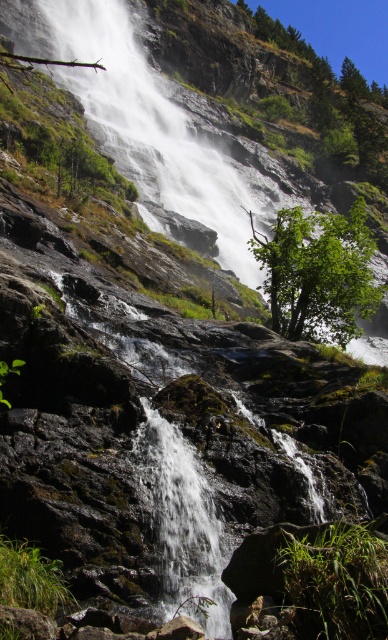
Is the position of green leafy tree at center less distant than that of clear water at center?

No, it is not.

In the scene shown: Who is shorter, green leafy tree at center or clear water at center?

Standing shorter between the two is clear water at center.

Who is more forward, (330, 285) or (154, 429)?

Positioned in front is point (154, 429).

This screenshot has width=388, height=640. Identify the location of green leafy tree at center. (318, 273).

Can you confirm if white smooth waterfall at center is positioned above green leafy tree at center?

Yes, white smooth waterfall at center is above green leafy tree at center.

The image size is (388, 640). Find the location of `white smooth waterfall at center`. white smooth waterfall at center is located at coordinates (152, 129).

Between point (97, 131) and point (282, 209), which one is positioned in front?

Positioned in front is point (97, 131).

You are a GUI agent. You are given a task and a screenshot of the screen. Output one action in this format:
    pyautogui.click(x=<x>, y=<y>)
    Task: Click on the white smooth waterfall at center
    Image resolution: width=388 pixels, height=640 pixels.
    Given the screenshot: What is the action you would take?
    pyautogui.click(x=152, y=129)

Can you confirm if white smooth waterfall at center is shorter than clear water at center?

No.

Can you confirm if white smooth waterfall at center is positioned below clear water at center?

No, white smooth waterfall at center is not below clear water at center.

Does point (131, 22) come closer to viewer compared to point (207, 540)?

That is False.

This screenshot has height=640, width=388. Find the location of `white smooth waterfall at center`. white smooth waterfall at center is located at coordinates (152, 129).